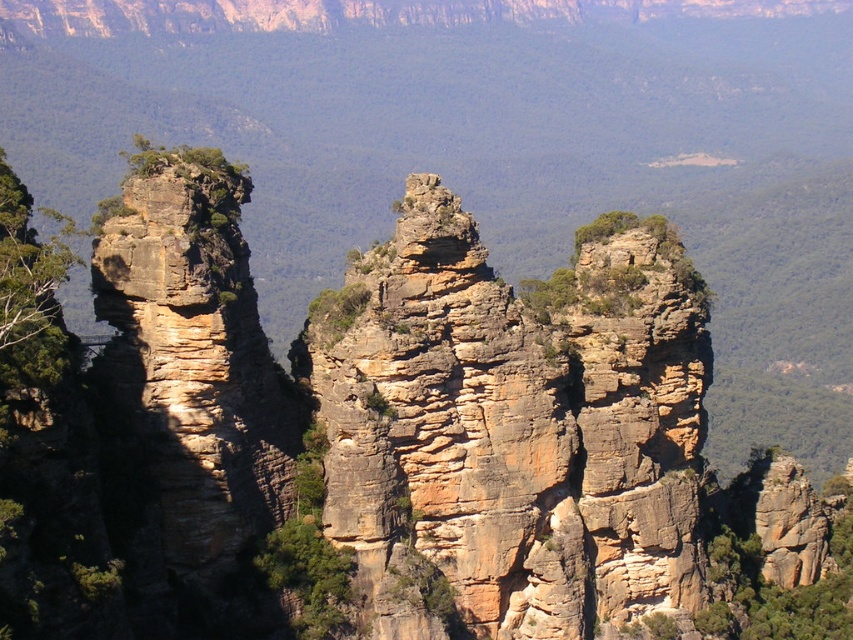
Question: Is rustic stone rock formation at center smaller than green rough rock at center?

Choices:
 (A) no
 (B) yes

Answer: (A)

Question: Does rustic stone rock formation at center appear on the left side of green rough rock at center?

Choices:
 (A) no
 (B) yes

Answer: (A)

Question: Considering the relative positions of rustic stone rock formation at center and green rough rock at center in the image provided, where is rustic stone rock formation at center located with respect to green rough rock at center?

Choices:
 (A) above
 (B) below

Answer: (A)

Question: Among these objects, which one is farthest from the camera?

Choices:
 (A) green rough rock at center
 (B) rustic stone rock formation at center

Answer: (B)

Question: Among these points, which one is farthest from the camera?

Choices:
 (A) click(x=263, y=579)
 (B) click(x=474, y=332)

Answer: (B)